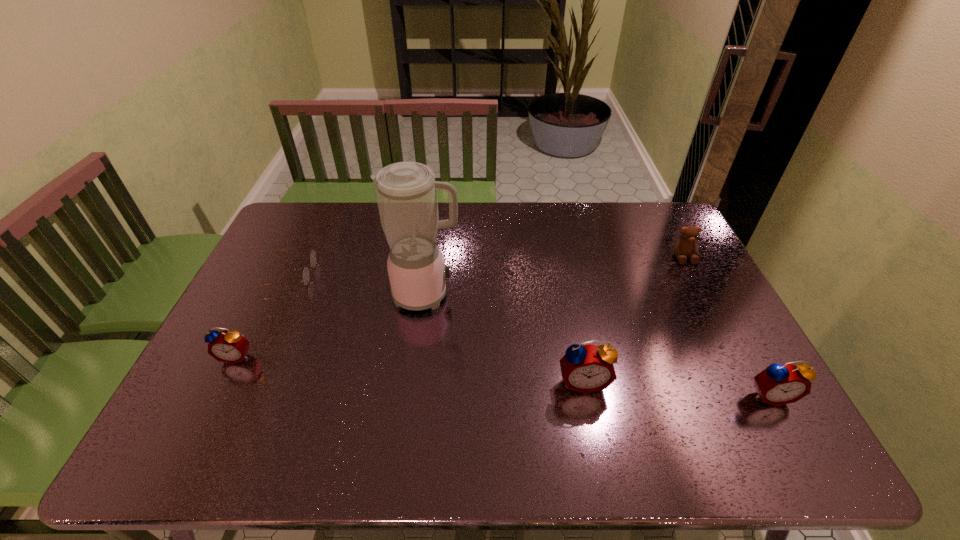
Identify the location of free space between the spectacles and the fourth object from left to right. This screenshot has width=960, height=540. (438, 328).

The width and height of the screenshot is (960, 540). Find the location of `vacant area that lies between the second tallest alarm clock and the tallest object`. vacant area that lies between the second tallest alarm clock and the tallest object is located at coordinates pyautogui.click(x=598, y=345).

I want to click on empty space that is in between the teddy bear and the farthest alarm clock, so click(x=460, y=307).

Locate an element on the screen. vacant area that lies between the spectacles and the second alarm clock from left to right is located at coordinates (438, 328).

Identify the location of vacant area that lies between the teddy bear and the shortest alarm clock. The height and width of the screenshot is (540, 960). (460, 307).

Identify which object is located as the fifth nearest to the shortest alarm clock. Please provide its 2D coordinates. Your answer should be formatted as a tuple, i.e. [(x, y)], where the tuple contains the x and y coordinates of a point satisfying the conditions above.

[(686, 245)]

This screenshot has width=960, height=540. Find the location of `object that is the fourth closest one to the fourth object from left to right`. object that is the fourth closest one to the fourth object from left to right is located at coordinates (313, 257).

Identify which alarm clock is located as the nearest to the fourth object from right to left. Please provide its 2D coordinates. Your answer should be formatted as a tuple, i.e. [(x, y)], where the tuple contains the x and y coordinates of a point satisfying the conditions above.

[(588, 368)]

Identify the location of alarm clock that is the closest one to the third tallest object. (588, 368).

This screenshot has height=540, width=960. In order to click on free space that satisfies the following two spatial constraints: 1. on the base of the tallest object near the control knob; 2. on the front-facing side of the leftmost alarm clock in this screenshot , I will do `click(419, 356)`.